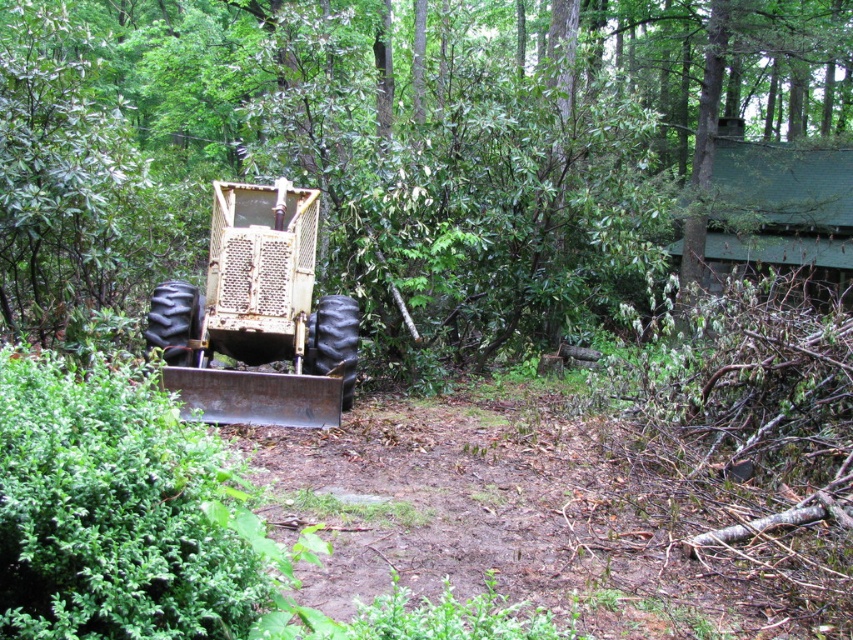
Question: Is green leafy tree at center below rusty metal tractor at center?

Choices:
 (A) yes
 (B) no

Answer: (B)

Question: Is the position of green leafy tree at center more distant than that of rusty metal tractor at center?

Choices:
 (A) no
 (B) yes

Answer: (B)

Question: Is green leafy tree at center below rusty metal tractor at center?

Choices:
 (A) yes
 (B) no

Answer: (B)

Question: Which point is farther from the camera taking this photo?

Choices:
 (A) (242, 358)
 (B) (252, 38)

Answer: (B)